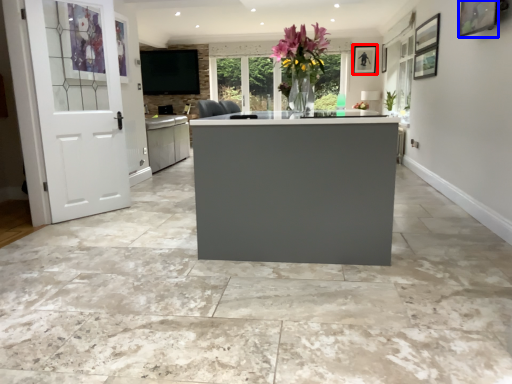
Question: Which point is closer to the camera, picture frame (highlighted by a red box) or picture frame (highlighted by a blue box)?

Choices:
 (A) picture frame
 (B) picture frame

Answer: (B)